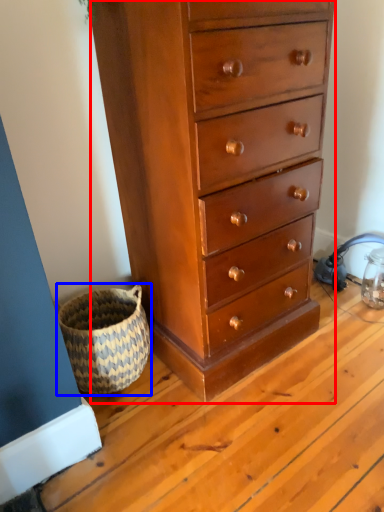
Question: Which of the following is the closest to the observer, chest of drawers (highlighted by a red box) or basket (highlighted by a blue box)?

Choices:
 (A) chest of drawers
 (B) basket

Answer: (A)